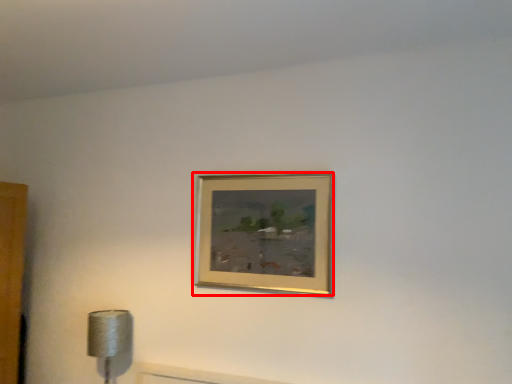
Question: Considering the relative positions of picture frame (annotated by the red box) and lamp in the image provided, where is picture frame (annotated by the red box) located with respect to the staircase?

Choices:
 (A) left
 (B) right

Answer: (B)